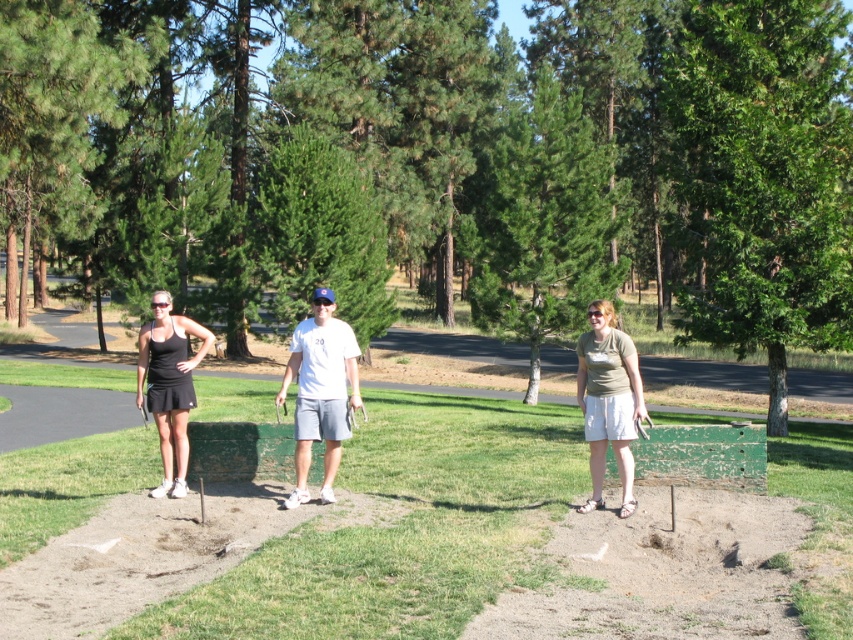
Question: Which object appears farthest from the camera in this image?

Choices:
 (A) white cotton t-shirt at center
 (B) black matte tennis skirt at left

Answer: (B)

Question: Does green painted wood at center appear on the left side of white cotton t-shirt at center?

Choices:
 (A) no
 (B) yes

Answer: (A)

Question: Is light green fabric shirt at center positioned at the back of black matte tennis racket at left?

Choices:
 (A) yes
 (B) no

Answer: (B)

Question: Is light green fabric shirt at center behind black matte tennis skirt at left?

Choices:
 (A) yes
 (B) no

Answer: (B)

Question: Which of the following is the farthest from the observer?

Choices:
 (A) (390, 433)
 (B) (338, 387)
 (C) (329, 436)
 (D) (595, 307)

Answer: (A)

Question: Which object is positioned closest to the black matte tennis skirt at left?

Choices:
 (A) green painted wood at center
 (B) white cotton t-shirt at center
 (C) light green fabric shirt at center

Answer: (B)